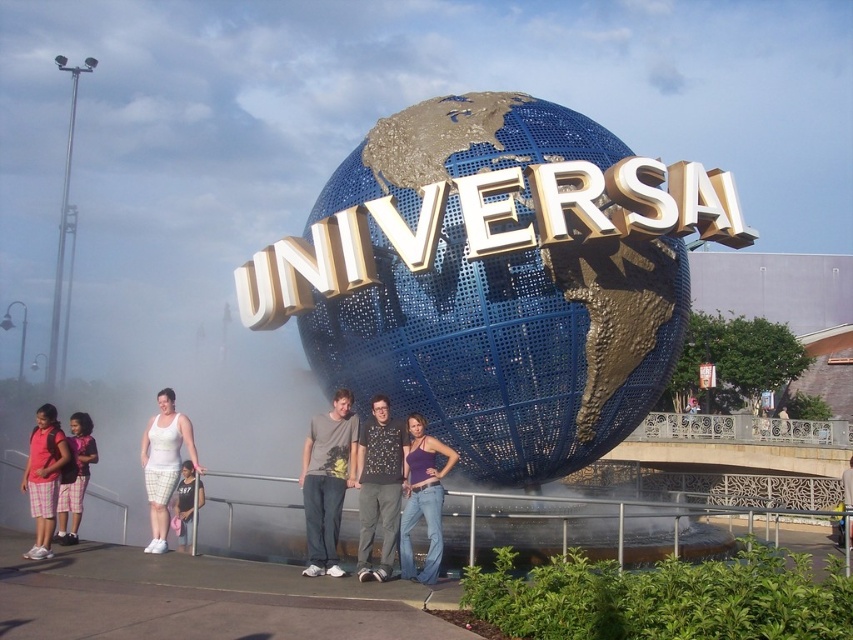
You are a photographer at Universal Studios and want to ensure that both the plaid shorts at lower left and the white cotton tank top at lower left are clearly visible in your photo. Given their sizes, which clothing item might require more careful framing to ensure it doesn t get lost in the background?

The white cotton tank top at lower left is smaller in size than the plaid shorts at lower left, so it might require more careful framing to ensure it doesn t get lost in the background.

You are standing at the Universal Studios globe sculpture and want to take a photo of the two points marked on the sculpture. Which point, point (515, 296) or point (74, 506), will appear larger in your photo?

Point (515, 296) will appear larger in the photo because it is closer to the camera than point (74, 506).